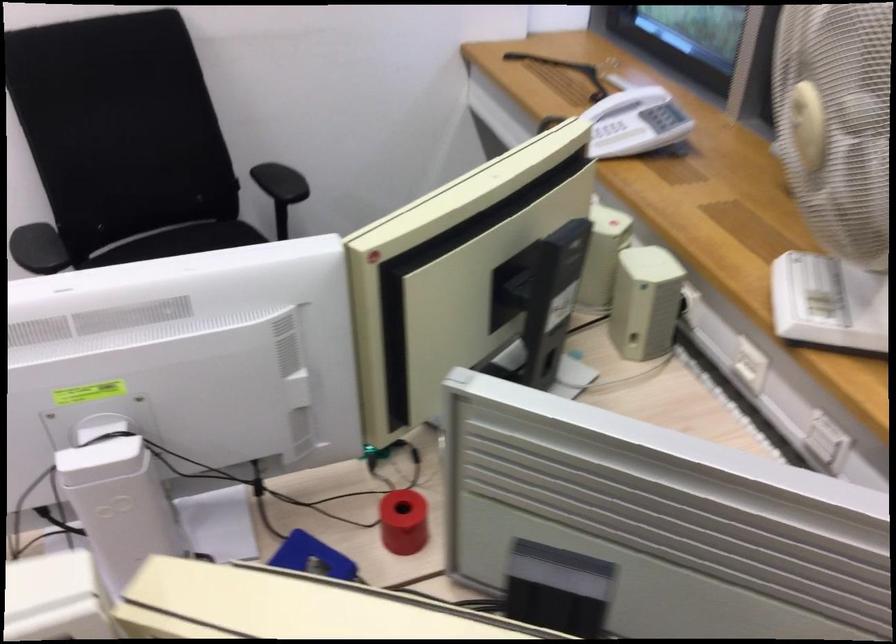
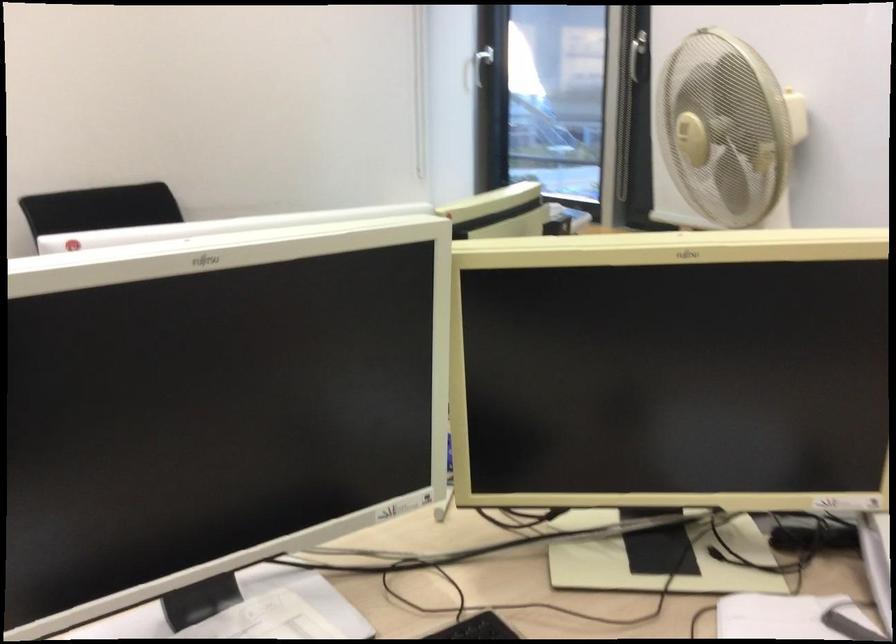
Question: I am providing you with two images of the same scene from different viewpoints. Please identify which objects are invisible in image2.

Choices:
 (A) scanner lid
 (B) beige computer speaker
 (C) blue strap handle
 (D) fan control knob

Answer: (B)